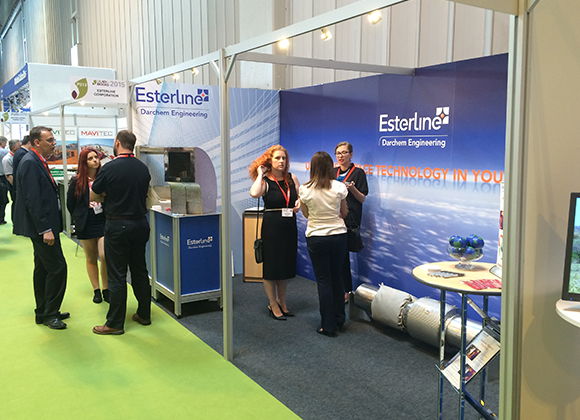
The height and width of the screenshot is (420, 580). I want to click on table top, so click(x=429, y=271).